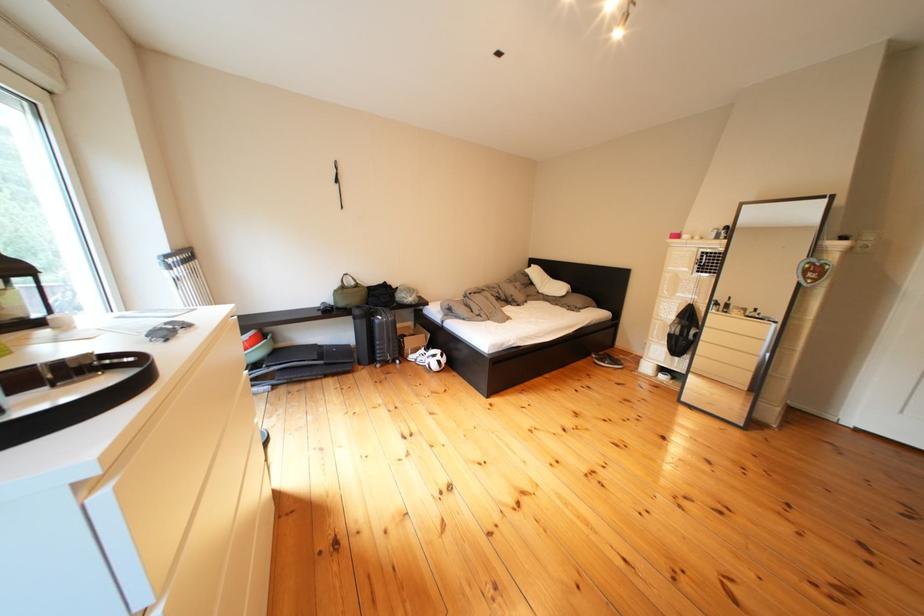
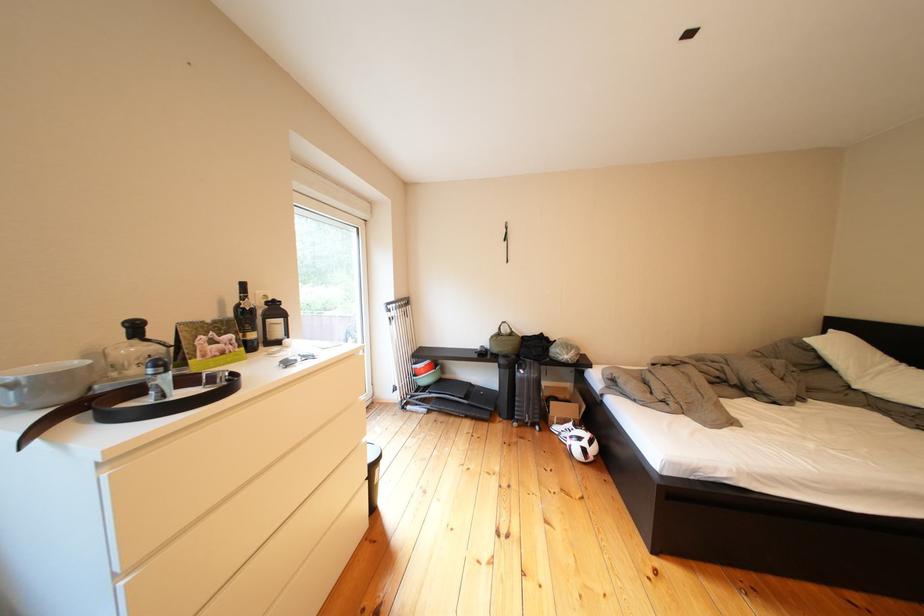
Locate, in the second image, the point that corresponds to (296,350) in the first image.

(462, 381)